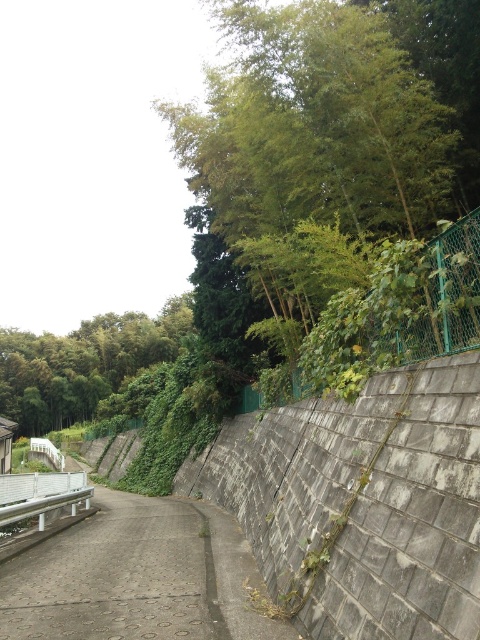
Can you confirm if green bamboo at upper right is shorter than white glossy rail at lower left?

No, green bamboo at upper right is not shorter than white glossy rail at lower left.

Who is positioned more to the right, green bamboo at upper right or white glossy rail at lower left?

green bamboo at upper right is more to the right.

Does point (315, 189) lie in front of point (35, 493)?

Yes.

Where is `green bamboo at upper right`? green bamboo at upper right is located at coordinates (336, 116).

Is point (222, 92) positioned before point (25, 362)?

Yes, it is.

Which is more to the right, green bamboo at upper right or green leafy tree at upper left?

green bamboo at upper right

Between point (361, 61) and point (74, 378), which one is positioned in front?

Point (361, 61) is more forward.

Locate an element on the screen. The width and height of the screenshot is (480, 640). green bamboo at upper right is located at coordinates (336, 116).

Based on the photo, which of these two, green leafy tree at upper left or white glossy rail at lower left, stands taller?

Standing taller between the two is green leafy tree at upper left.

Does point (13, 419) lie in front of point (68, 486)?

No, (13, 419) is further to viewer.

Identify the location of green leafy tree at upper left. (84, 364).